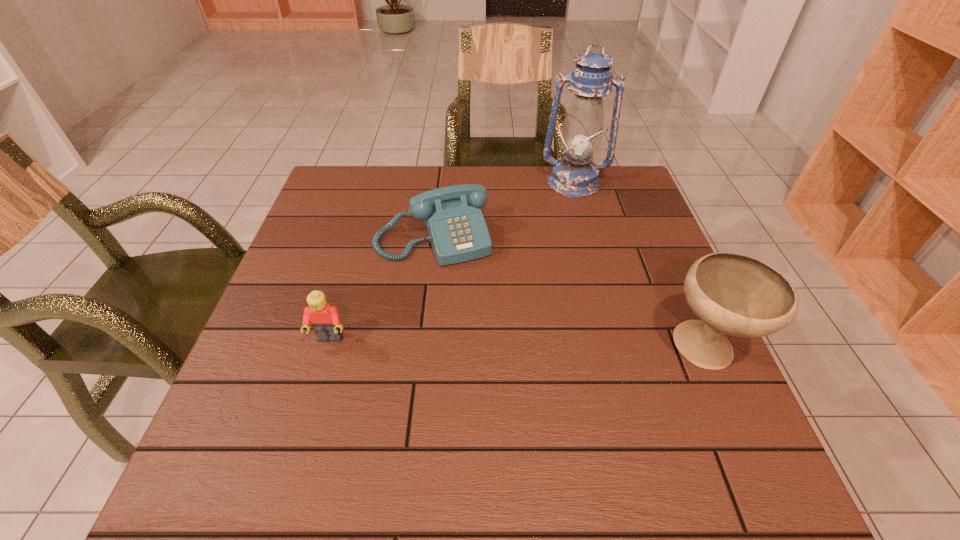
Find the location of a particular element. The image size is (960, 540). free location that satisfies the following two spatial constraints: 1. on the front side of the third shortest object; 2. on the right side of the third nearest object is located at coordinates (420, 349).

Find the location of a particular element. free spot that satisfies the following two spatial constraints: 1. on the face of the third shortest object; 2. on the left side of the Lego is located at coordinates pyautogui.click(x=326, y=349).